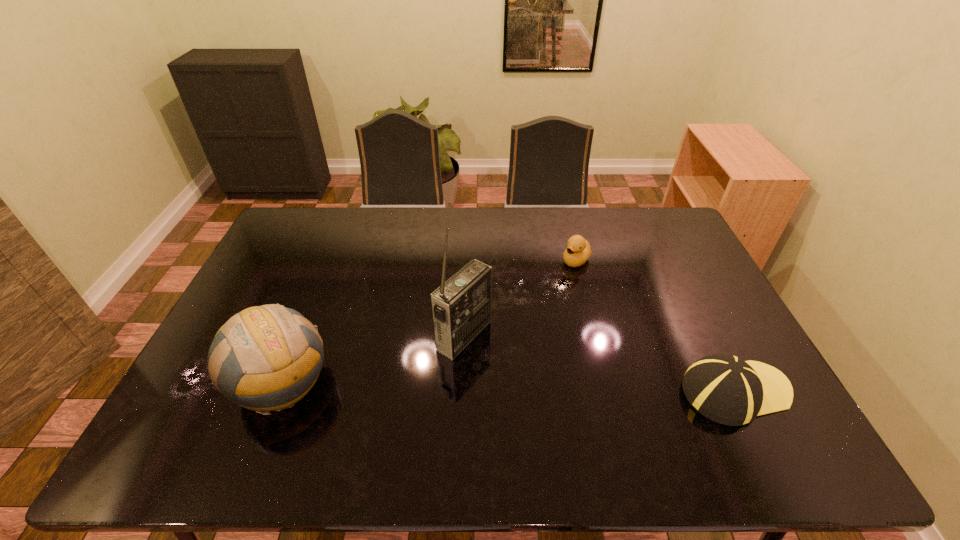
The image size is (960, 540). Identify the location of vacant space on the desktop that is between the leftmost object and the baseball cap and is positioned facing forward on the farthest object. (445, 387).

Locate an element on the screen. vacant space on the desktop that is between the leftmost object and the baseball cap and is positioned on the display of the third object from right to left is located at coordinates (557, 389).